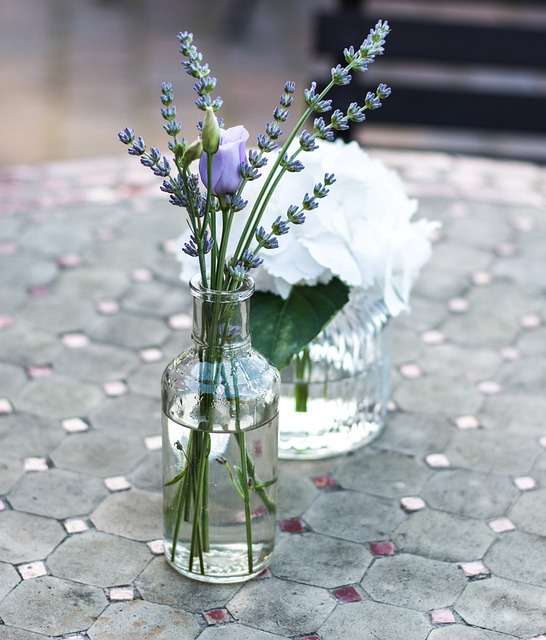
Locate an element on the screen. This screenshot has width=546, height=640. neck of vase is located at coordinates (223, 294).